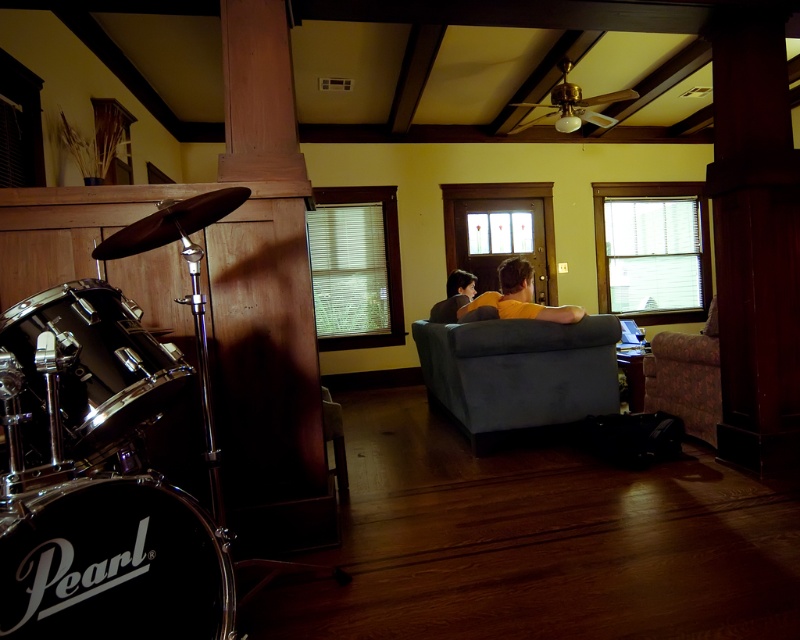
Question: Which object is farther from the camera taking this photo?

Choices:
 (A) yellow t-shirt at center
 (B) shiny chrome drum at left

Answer: (A)

Question: Can you confirm if velvet blue ottoman at center is positioned above floral fabric couch at right?

Choices:
 (A) yes
 (B) no

Answer: (B)

Question: Which is nearer to the shiny chrome drum at left?

Choices:
 (A) yellow t-shirt at center
 (B) velvet blue ottoman at center
 (C) floral fabric couch at right

Answer: (B)

Question: Does velvet blue ottoman at center have a lesser width compared to shiny chrome drum at left?

Choices:
 (A) no
 (B) yes

Answer: (A)

Question: Does shiny chrome drum at left have a larger size compared to yellow t-shirt at center?

Choices:
 (A) yes
 (B) no

Answer: (B)

Question: Which point is closer to the camera?

Choices:
 (A) shiny chrome drum at left
 (B) black pearl drum at lower left
 (C) velvet blue ottoman at center

Answer: (B)